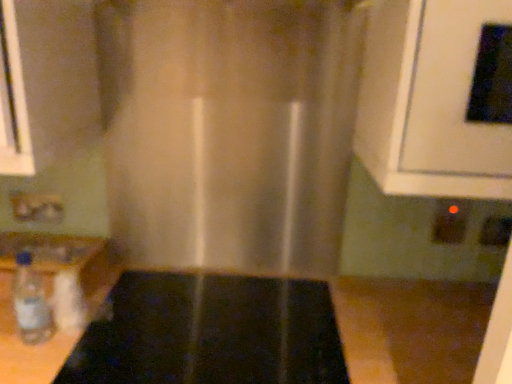
Question: Can you confirm if black glossy oven at upper right is bigger than matte plastic electric outlet at lower left, which is the third electric outlet in right-to-left order?

Choices:
 (A) yes
 (B) no

Answer: (A)

Question: Is black glossy oven at upper right further to the viewer compared to matte plastic electric outlet at lower left, the first electric outlet from the left?

Choices:
 (A) no
 (B) yes

Answer: (A)

Question: Could you tell me if black glossy oven at upper right is turned towards matte plastic electric outlet at lower left, the first electric outlet from the left?

Choices:
 (A) no
 (B) yes

Answer: (A)

Question: Is black glossy oven at upper right thinner than matte plastic electric outlet at lower left, the first electric outlet from the left?

Choices:
 (A) no
 (B) yes

Answer: (A)

Question: Can you confirm if black glossy oven at upper right is taller than matte plastic electric outlet at lower left, which is the third electric outlet in right-to-left order?

Choices:
 (A) yes
 (B) no

Answer: (A)

Question: Is matte plastic electric outlet at lower left, the first electric outlet from the left, located within black glossy oven at upper right?

Choices:
 (A) no
 (B) yes

Answer: (A)

Question: From a real-world perspective, is black glossy oven at upper right under black plastic electric outlet at lower right, which is the 2th electric outlet from right to left?

Choices:
 (A) no
 (B) yes

Answer: (A)

Question: From the image's perspective, is black glossy oven at upper right beneath black plastic electric outlet at lower right, the 2th electric outlet positioned from the left?

Choices:
 (A) no
 (B) yes

Answer: (A)

Question: Is black glossy oven at upper right looking in the opposite direction of black plastic electric outlet at lower right, the 2th electric outlet positioned from the left?

Choices:
 (A) no
 (B) yes

Answer: (A)

Question: Is black glossy oven at upper right shorter than black plastic electric outlet at lower right, the 2th electric outlet positioned from the left?

Choices:
 (A) yes
 (B) no

Answer: (B)

Question: Can you confirm if black glossy oven at upper right is wider than black plastic electric outlet at lower right, which is the 2th electric outlet from right to left?

Choices:
 (A) no
 (B) yes

Answer: (B)

Question: Could black plastic electric outlet at lower right, the 2th electric outlet positioned from the left, be considered to be inside black glossy oven at upper right?

Choices:
 (A) no
 (B) yes

Answer: (A)

Question: Are clear plastic bottle at lower left and black glossy oven at upper right far apart?

Choices:
 (A) yes
 (B) no

Answer: (B)